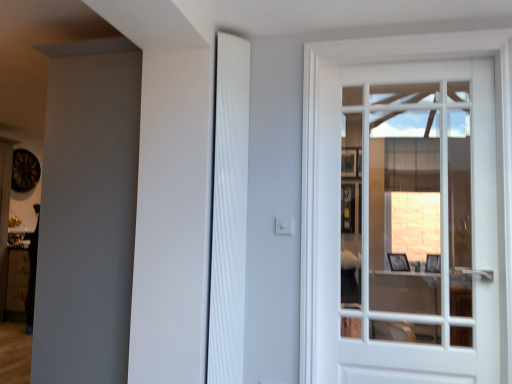
Question: Considering the positions of point coord(368,168) and point coord(207,362), is point coord(368,168) closer or farther from the camera than point coord(207,362)?

Choices:
 (A) farther
 (B) closer

Answer: (A)

Question: From a real-world perspective, is white glass door at right positioned above or below white ribbed shutter at center?

Choices:
 (A) below
 (B) above

Answer: (A)

Question: From their relative heights in the image, would you say white glass door at right is taller or shorter than white ribbed shutter at center?

Choices:
 (A) tall
 (B) short

Answer: (B)

Question: Does point (214, 140) appear closer or farther from the camera than point (438, 236)?

Choices:
 (A) farther
 (B) closer

Answer: (B)

Question: Relative to white glass door at right, is white ribbed shutter at center in front or behind?

Choices:
 (A) front
 (B) behind

Answer: (B)

Question: In terms of height, does white ribbed shutter at center look taller or shorter compared to white glass door at right?

Choices:
 (A) tall
 (B) short

Answer: (A)

Question: From a real-world perspective, relative to white glass door at right, is white ribbed shutter at center vertically above or below?

Choices:
 (A) below
 (B) above

Answer: (B)